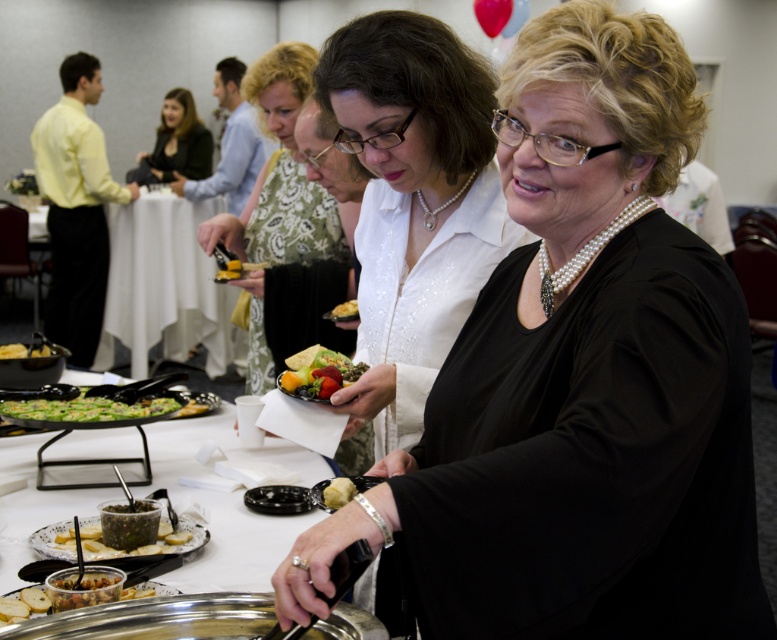
Looking at this image, you are a guest at this event and want to grab a fruit from the shiny metallic bowl at lower left and a piece of cheese from the metallic silver platter at lower left. Which dish will you reach first?

The shiny metallic bowl at lower left is closer to the viewer than the metallic silver platter at lower left, so you will reach the shiny metallic bowl at lower left first.

You are a guest at this event and want to place your shiny metallic bowl at lower left on top of the matte black dress at center. Is this possible based on their sizes?

The matte black dress at center is larger in size than the shiny metallic bowl at lower left, so yes, the shiny metallic bowl at lower left can be placed on top of the matte black dress at center since it is smaller in size.